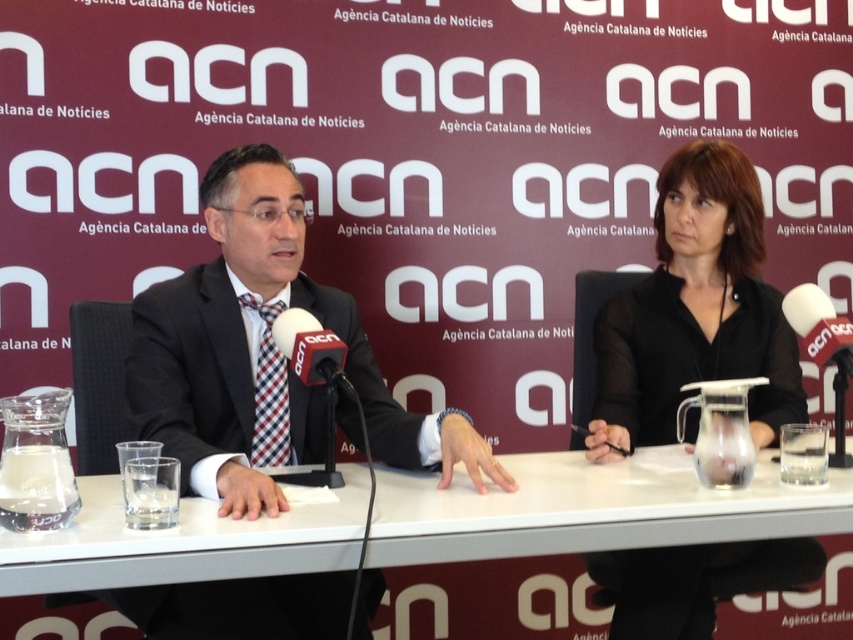
From the picture: Does white glossy table at center have a lesser height compared to white matte microphone at center?

Yes.

Who is positioned more to the right, white glossy table at center or white matte microphone at center?

Positioned to the right is white glossy table at center.

Does point (556, 522) come farther from viewer compared to point (340, 385)?

No, (556, 522) is in front of (340, 385).

What are the coordinates of `white glossy table at center` in the screenshot? It's located at (590, 508).

Image resolution: width=853 pixels, height=640 pixels. Describe the element at coordinates (194, 371) in the screenshot. I see `dark gray suit at center` at that location.

Does dark gray suit at center have a lesser height compared to white foam microphone at right?

No.

Which is in front, point (229, 412) or point (846, 358)?

Point (846, 358)

Where is `dark gray suit at center`? This screenshot has height=640, width=853. dark gray suit at center is located at coordinates (194, 371).

Is white glossy table at center to the right of black matte shirt at center from the viewer's perspective?

No, white glossy table at center is not to the right of black matte shirt at center.

Does white glossy table at center have a smaller size compared to black matte shirt at center?

Indeed, white glossy table at center has a smaller size compared to black matte shirt at center.

Is point (381, 564) more distant than point (679, 170)?

No.

I want to click on white glossy table at center, so click(x=590, y=508).